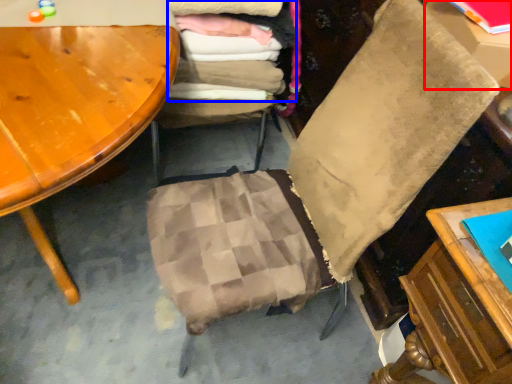
Question: Which object is further to the camera taking this photo, table (highlighted by a red box) or laundry (highlighted by a blue box)?

Choices:
 (A) table
 (B) laundry

Answer: (B)